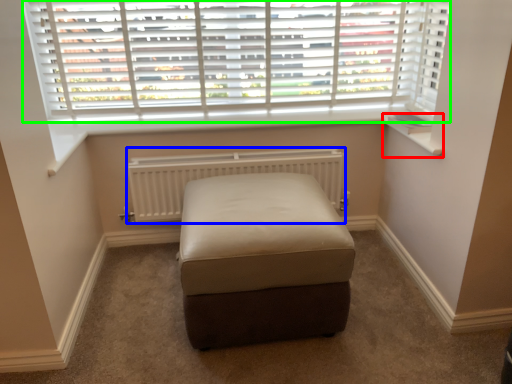
Question: Considering the real-world distances, which object is farthest from window sill (highlighted by a red box)? radiator (highlighted by a blue box) or window (highlighted by a green box)?

Choices:
 (A) radiator
 (B) window

Answer: (B)